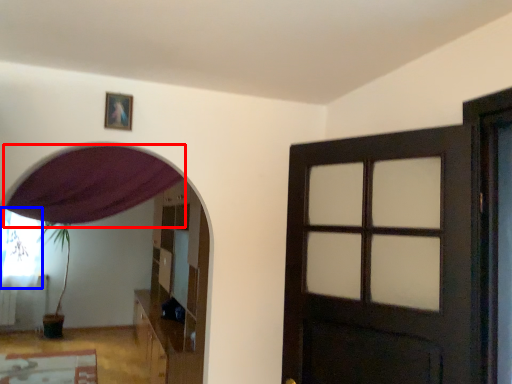
Question: Which point is further to the camera, curtain (highlighted by a red box) or curtain (highlighted by a blue box)?

Choices:
 (A) curtain
 (B) curtain

Answer: (B)